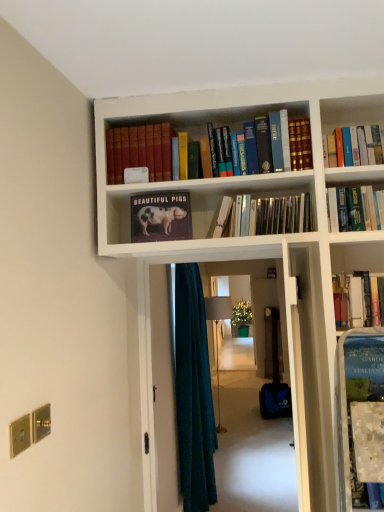
Question: Is matte paper book at center, which appears as the fourth book when viewed from the right, wider than dark teal fabric at center?

Choices:
 (A) yes
 (B) no

Answer: (B)

Question: Considering the relative sizes of matte paper book at center, which appears as the second book when viewed from the left, and dark teal fabric at center in the image provided, is matte paper book at center, which appears as the second book when viewed from the left, smaller than dark teal fabric at center?

Choices:
 (A) yes
 (B) no

Answer: (A)

Question: Could dark teal fabric at center be considered to be inside matte paper book at center, which appears as the second book when viewed from the left?

Choices:
 (A) no
 (B) yes

Answer: (A)

Question: Can you confirm if matte paper book at center, which appears as the fourth book when viewed from the right, is thinner than dark teal fabric at center?

Choices:
 (A) yes
 (B) no

Answer: (A)

Question: Are matte paper book at center, which appears as the second book when viewed from the left, and dark teal fabric at center located far from each other?

Choices:
 (A) yes
 (B) no

Answer: (A)

Question: From a real-world perspective, is matte paper book at center, which appears as the second book when viewed from the left, positioned over dark teal fabric at center based on gravity?

Choices:
 (A) no
 (B) yes

Answer: (B)

Question: Is matte paper book at center, which appears as the second book when viewed from the left, surrounding metallic silver books at center, the second book positioned from the right?

Choices:
 (A) no
 (B) yes

Answer: (A)

Question: Considering the relative sizes of matte paper book at center, which appears as the second book when viewed from the left, and metallic silver books at center, placed as the 4th book when sorted from left to right, in the image provided, is matte paper book at center, which appears as the second book when viewed from the left, taller than metallic silver books at center, placed as the 4th book when sorted from left to right,?

Choices:
 (A) no
 (B) yes

Answer: (B)

Question: Can you confirm if matte paper book at center, which appears as the fourth book when viewed from the right, is shorter than metallic silver books at center, the second book positioned from the right?

Choices:
 (A) yes
 (B) no

Answer: (B)

Question: Is matte paper book at center, which appears as the second book when viewed from the left, to the left of metallic silver books at center, the second book positioned from the right, from the viewer's perspective?

Choices:
 (A) no
 (B) yes

Answer: (B)

Question: Is the depth of matte paper book at center, which appears as the second book when viewed from the left, greater than that of metallic silver books at center, the second book positioned from the right?

Choices:
 (A) yes
 (B) no

Answer: (B)

Question: From the image's perspective, is matte paper book at center, which appears as the second book when viewed from the left, beneath metallic silver books at center, placed as the 4th book when sorted from left to right?

Choices:
 (A) yes
 (B) no

Answer: (A)

Question: Is hardcover book at center, marked as the third book in a right-to-left arrangement, taller than teal fabric screen door at center?

Choices:
 (A) no
 (B) yes

Answer: (A)